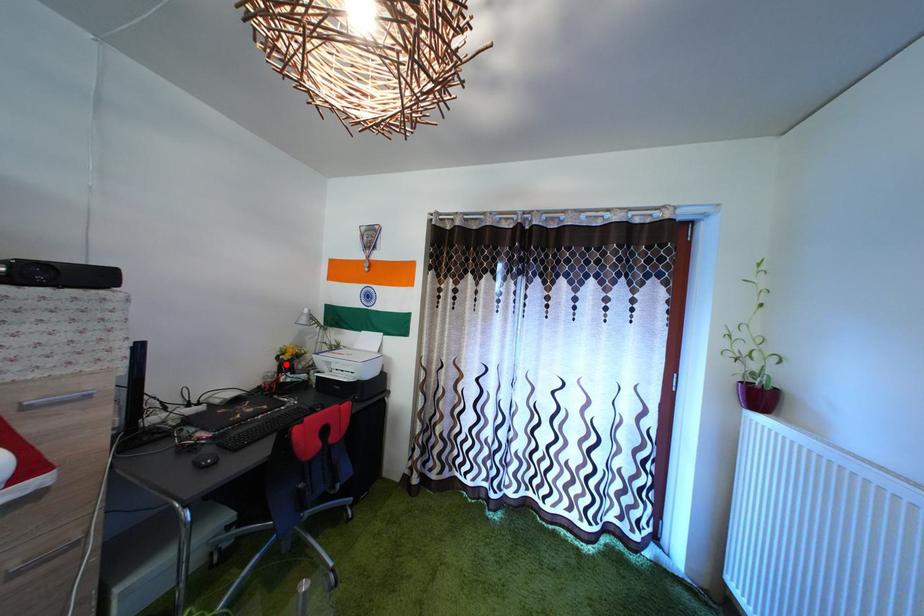
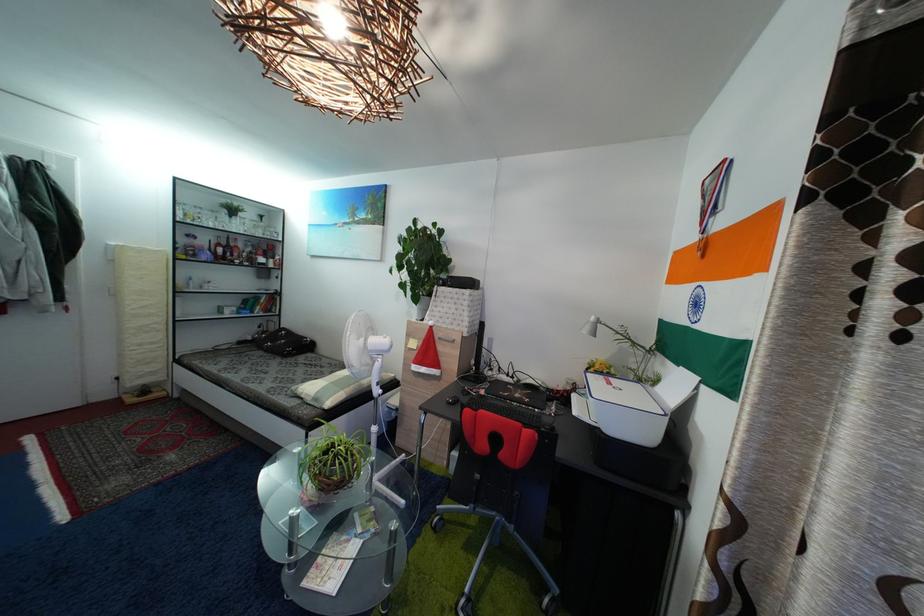
Locate, in the second image, the point that corresponds to the highlighted location in the first image.

(596, 377)